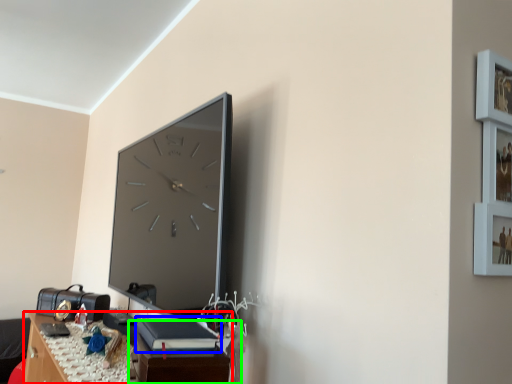
Question: Which object is positioned closest to table (highlighted by a red box)? Select from book (highlighted by a blue box) and table (highlighted by a green box).

Choices:
 (A) book
 (B) table

Answer: (B)